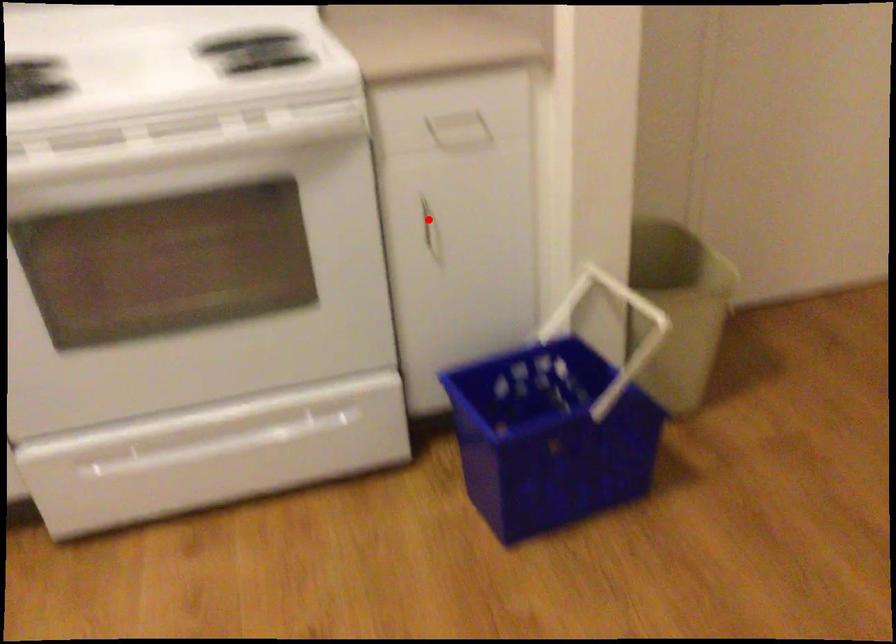
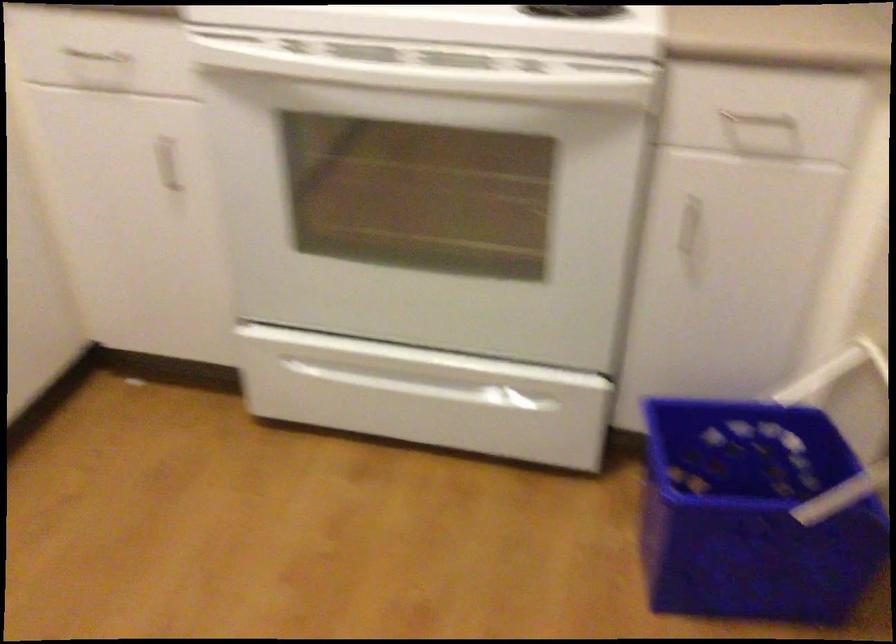
Where in the second image is the point corresponding to the highlighted location from the first image?

(691, 228)